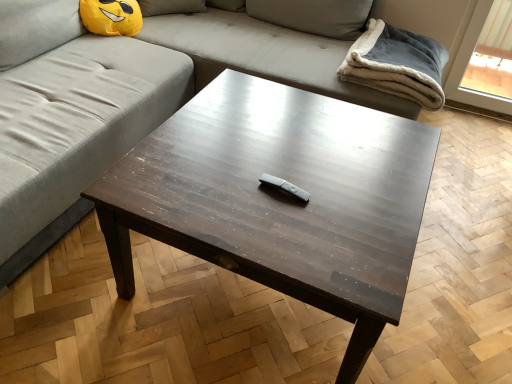
Identify the location of free space in front of gray matte wii remote at center. (283, 230).